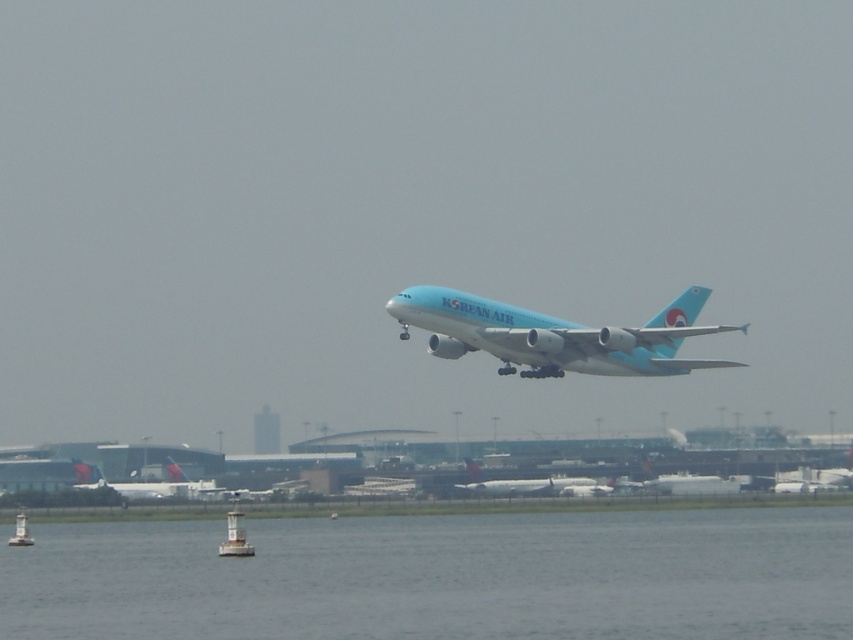
Question: Is white plastic buoy at lower center smaller than white plastic buoy at lower left?

Choices:
 (A) yes
 (B) no

Answer: (B)

Question: Which of the following is the closest to the observer?

Choices:
 (A) white glossy airplane at lower left
 (B) transparent water at lower center

Answer: (B)

Question: Which object is positioned farthest from the transparent water at lower center?

Choices:
 (A) light blue metallic airplane at center
 (B) light blue glossy airplane at center

Answer: (A)

Question: Which object is the farthest from the white plastic buoy at lower left?

Choices:
 (A) white glossy airplane at lower left
 (B) white plastic buoy at lower center

Answer: (B)

Question: Does light blue glossy airplane at center have a larger size compared to white plastic buoy at lower center?

Choices:
 (A) no
 (B) yes

Answer: (B)

Question: Is light blue glossy airplane at center to the right of white plastic buoy at lower center from the viewer's perspective?

Choices:
 (A) no
 (B) yes

Answer: (B)